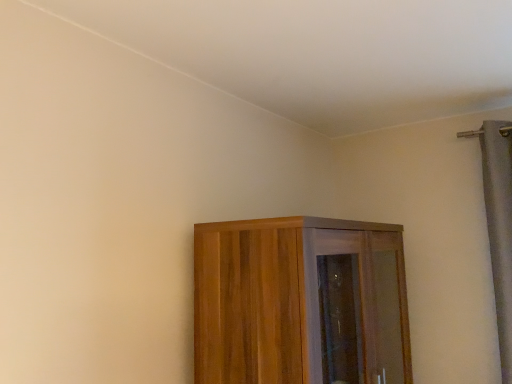
The width and height of the screenshot is (512, 384). I want to click on wooden cabinet at center, so click(300, 302).

What do you see at coordinates (300, 302) in the screenshot?
I see `wooden cabinet at center` at bounding box center [300, 302].

Identify the location of wooden cabinet at center. Image resolution: width=512 pixels, height=384 pixels. pos(300,302).